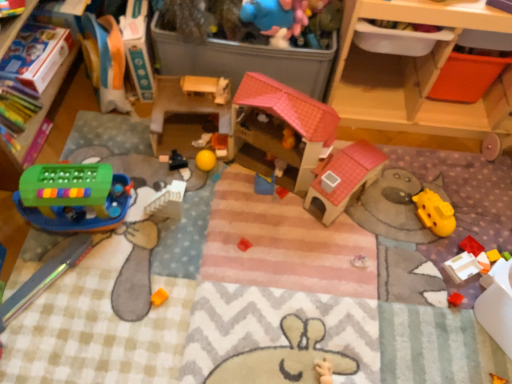
Locate an element on the screen. The height and width of the screenshot is (384, 512). empty space that is in between bright red plastic block at lower right, which appears as the first toy when viewed from the right, and yellow plastic spoon at center, the 7th toy when ordered from left to right is located at coordinates (379, 225).